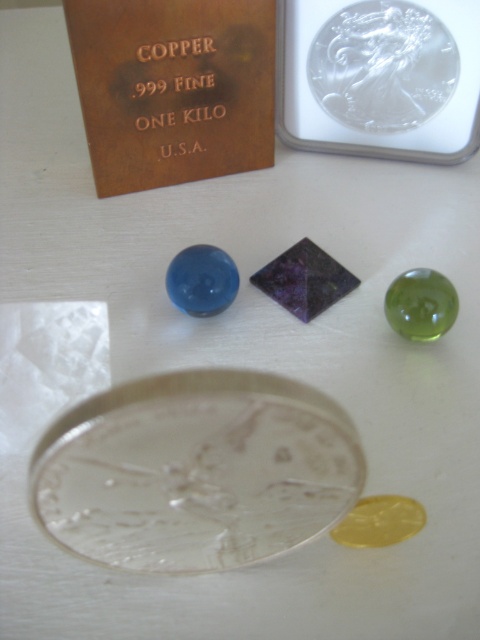
Question: Which object is the farthest from the copper metallic plaque at upper left?

Choices:
 (A) yellow translucent coin at lower center
 (B) clear glass coin at center

Answer: (A)

Question: Which point appears farthest from the camera in this image?

Choices:
 (A) (86, 106)
 (B) (402, 113)

Answer: (B)

Question: Does clear glass coin at center appear over copper metallic plaque at upper left?

Choices:
 (A) yes
 (B) no

Answer: (B)

Question: Among these objects, which one is nearest to the camera?

Choices:
 (A) clear glass coin at upper center
 (B) clear glass coin at center

Answer: (B)

Question: Is clear glass coin at center bigger than clear glass coin at upper center?

Choices:
 (A) no
 (B) yes

Answer: (B)

Question: Does clear glass coin at center come in front of yellow translucent coin at lower center?

Choices:
 (A) yes
 (B) no

Answer: (A)